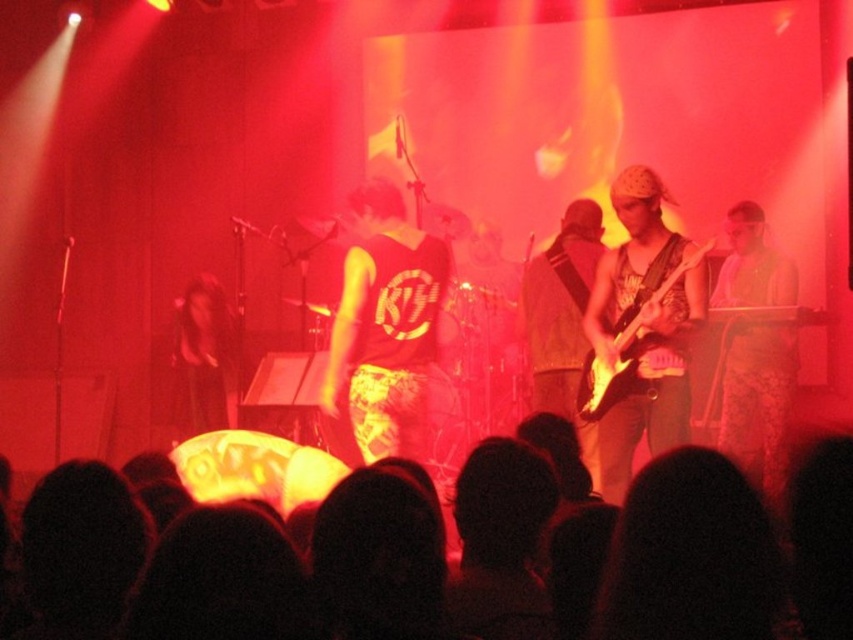
Question: Which of these objects is positioned closest to the patterned fabric dress at right?

Choices:
 (A) yellow fabric shirt at center
 (B) shiny black electric guitar at center
 (C) silhouette crowd at lower center

Answer: (B)

Question: Can you confirm if yellow fabric shirt at center is positioned above shiny black electric guitar at center?

Choices:
 (A) yes
 (B) no

Answer: (A)

Question: Among these points, which one is nearest to the camera?

Choices:
 (A) (778, 300)
 (B) (642, 547)
 (C) (425, 378)
 (D) (619, 326)

Answer: (B)

Question: Is silhouette crowd at lower center to the left of patterned fabric dress at right from the viewer's perspective?

Choices:
 (A) no
 (B) yes

Answer: (B)

Question: Is yellow fabric shirt at center in front of shiny black electric guitar at center?

Choices:
 (A) yes
 (B) no

Answer: (B)

Question: Which of the following is the farthest from the observer?

Choices:
 (A) silhouette crowd at lower center
 (B) patterned fabric dress at right

Answer: (B)